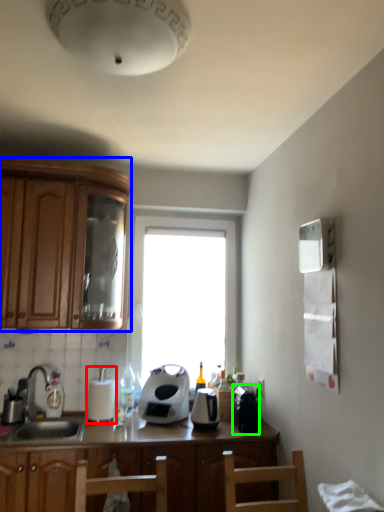
Question: Which object is the farthest from appliance (highlighted by a red box)? Choose among these: cabinetry (highlighted by a blue box) or coffee machine (highlighted by a green box).

Choices:
 (A) cabinetry
 (B) coffee machine

Answer: (B)